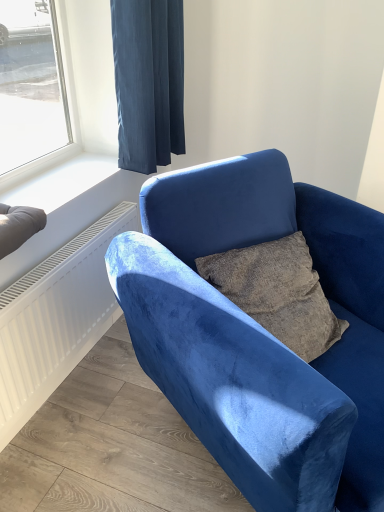
Question: Does velvet blue chair at center appear on the right side of dark blue velvet curtain at upper center?

Choices:
 (A) no
 (B) yes

Answer: (B)

Question: Is dark blue velvet curtain at upper center at the back of velvet blue chair at center?

Choices:
 (A) yes
 (B) no

Answer: (A)

Question: Does velvet blue chair at center have a greater height compared to dark blue velvet curtain at upper center?

Choices:
 (A) no
 (B) yes

Answer: (B)

Question: From a real-world perspective, is velvet blue chair at center physically below dark blue velvet curtain at upper center?

Choices:
 (A) no
 (B) yes

Answer: (B)

Question: Is the surface of velvet blue chair at center in direct contact with dark blue velvet curtain at upper center?

Choices:
 (A) no
 (B) yes

Answer: (A)

Question: Is velvet blue chair at center in front of dark blue velvet curtain at upper center?

Choices:
 (A) no
 (B) yes

Answer: (B)

Question: Can you confirm if velvet blue chair at center is smaller than white smooth window sill at upper left?

Choices:
 (A) no
 (B) yes

Answer: (A)

Question: Does velvet blue chair at center have a lesser width compared to white smooth window sill at upper left?

Choices:
 (A) yes
 (B) no

Answer: (B)

Question: Can you confirm if velvet blue chair at center is positioned to the right of white smooth window sill at upper left?

Choices:
 (A) no
 (B) yes

Answer: (B)

Question: Can you confirm if velvet blue chair at center is bigger than white smooth window sill at upper left?

Choices:
 (A) no
 (B) yes

Answer: (B)

Question: Is velvet blue chair at center further to the viewer compared to white smooth window sill at upper left?

Choices:
 (A) yes
 (B) no

Answer: (B)

Question: From the image's perspective, is velvet blue chair at center over white smooth window sill at upper left?

Choices:
 (A) yes
 (B) no

Answer: (B)

Question: Does dark blue velvet curtain at upper center have a greater height compared to white smooth window sill at upper left?

Choices:
 (A) no
 (B) yes

Answer: (B)